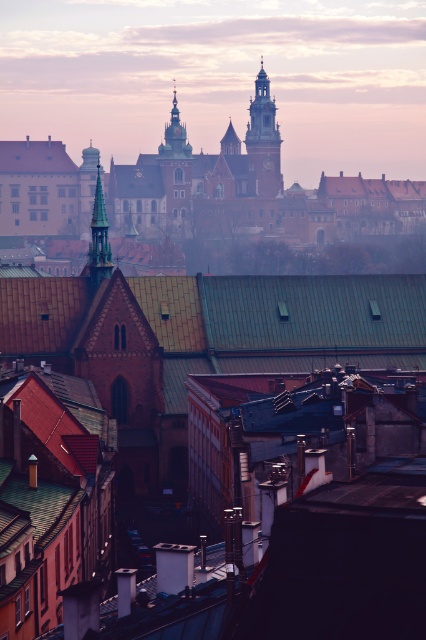
Looking at this image, who is positioned more to the left, brick tower at center or gold textured spire at upper center?

Positioned to the left is gold textured spire at upper center.

Between brick tower at center and gold textured spire at upper center, which one has more height?

Standing taller between the two is brick tower at center.

Between point (276, 157) and point (180, 136), which one is positioned behind?

The point (276, 157) is behind.

I want to click on brick tower at center, so click(264, 138).

Between foggy atmosphere at upper center and smooth green spire at center, which one has more height?

Standing taller between the two is foggy atmosphere at upper center.

Does foggy atmosphere at upper center appear on the right side of smooth green spire at center?

Yes, foggy atmosphere at upper center is to the right of smooth green spire at center.

Where is `foggy atmosphere at upper center`? foggy atmosphere at upper center is located at coordinates (221, 76).

Who is positioned more to the right, foggy atmosphere at upper center or gold textured spire at upper center?

foggy atmosphere at upper center is more to the right.

Does foggy atmosphere at upper center have a greater width compared to gold textured spire at upper center?

Indeed, foggy atmosphere at upper center has a greater width compared to gold textured spire at upper center.

Between point (144, 83) and point (166, 125), which one is positioned in front?

Point (166, 125) is more forward.

Identify the location of foggy atmosphere at upper center. (221, 76).